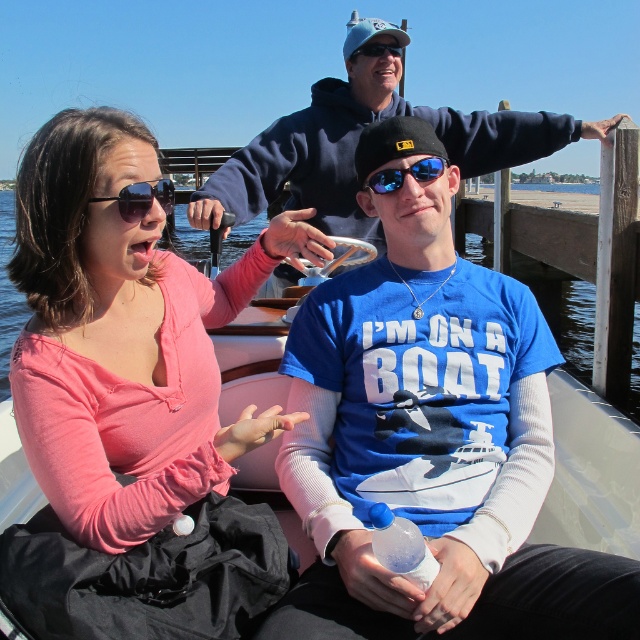
You are a passenger on the boat and you want to place a 15 cm wide object between the clear water at center and the translucent plastic bottle at center. Is there enough space?

The clear water at center is wider than the translucent plastic bottle at center. Since the object is 15 cm wide, you can place it between them as there is sufficient space.

Looking at this image, you are a photographer trying to capture a photo of the white plastic boat at center and the blue reflective sunglasses at center. Which object should you focus on first if you want to ensure both are in the frame without moving the camera?

The white plastic boat at center is wider than the blue reflective sunglasses at center, so focusing on the boat first would ensure both fit within the frame.